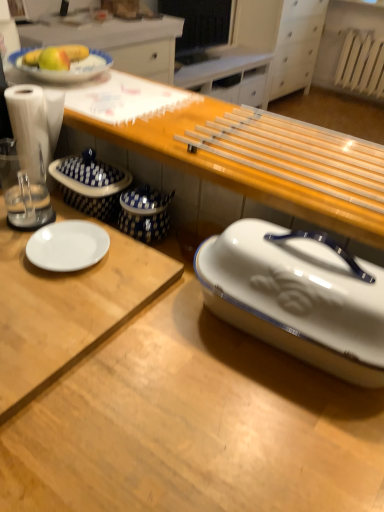
Find the location of a particular element. free space in front of transparent plastic blender at left is located at coordinates (29, 270).